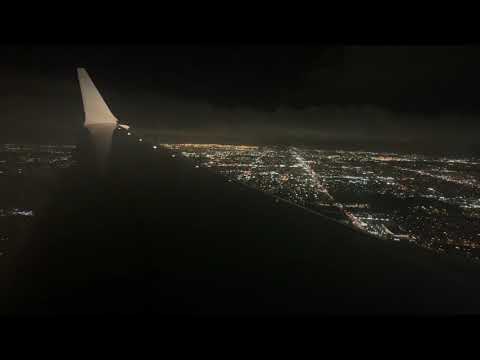
Image resolution: width=480 pixels, height=360 pixels. Find the location of `lights`. lights is located at coordinates (299, 158), (304, 166), (324, 189).